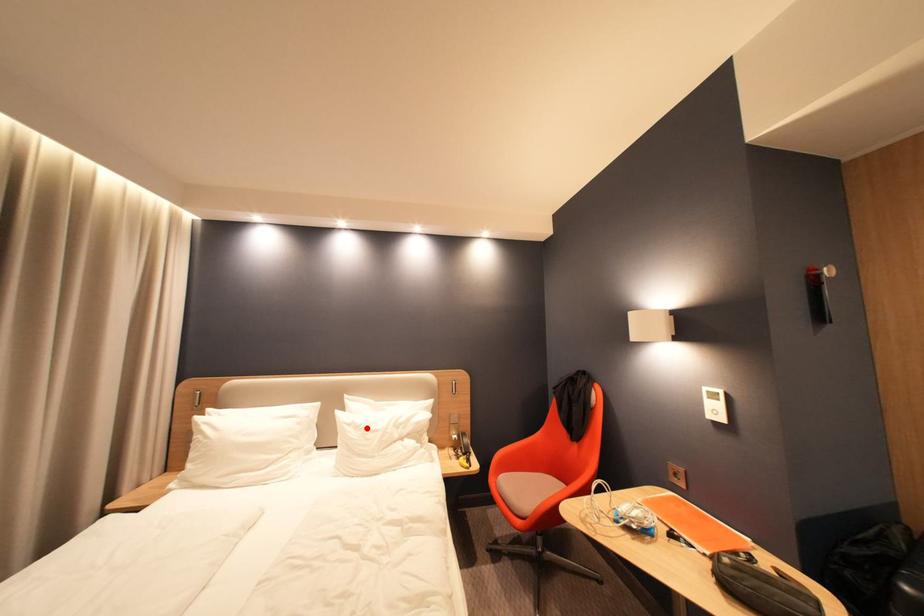
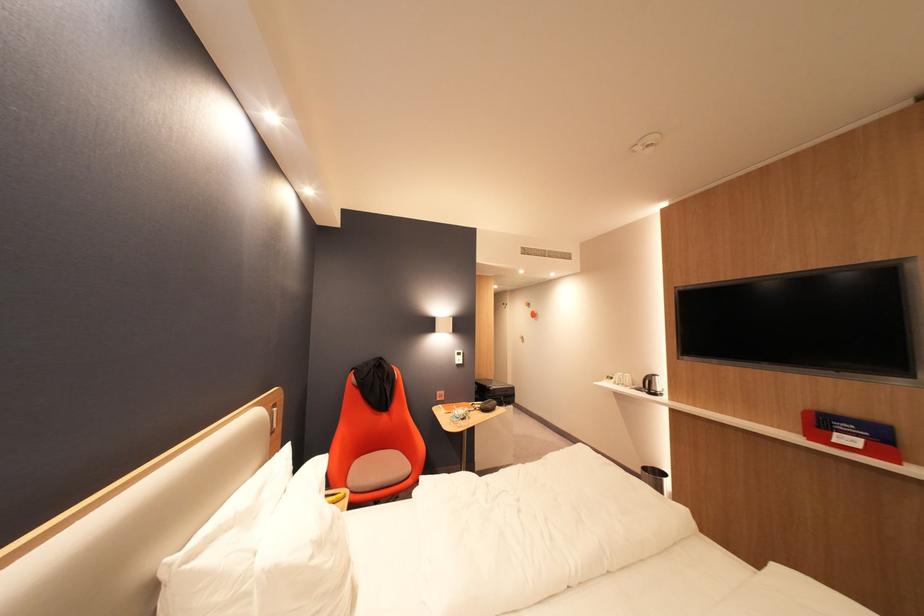
Question: A red point is marked in image1. In image2, is the corresponding 3D point closer to the camera or farther? Reply with the corresponding letter.

Choices:
 (A) The corresponding 3D point is closer.
 (B) The corresponding 3D point is farther.

Answer: (A)